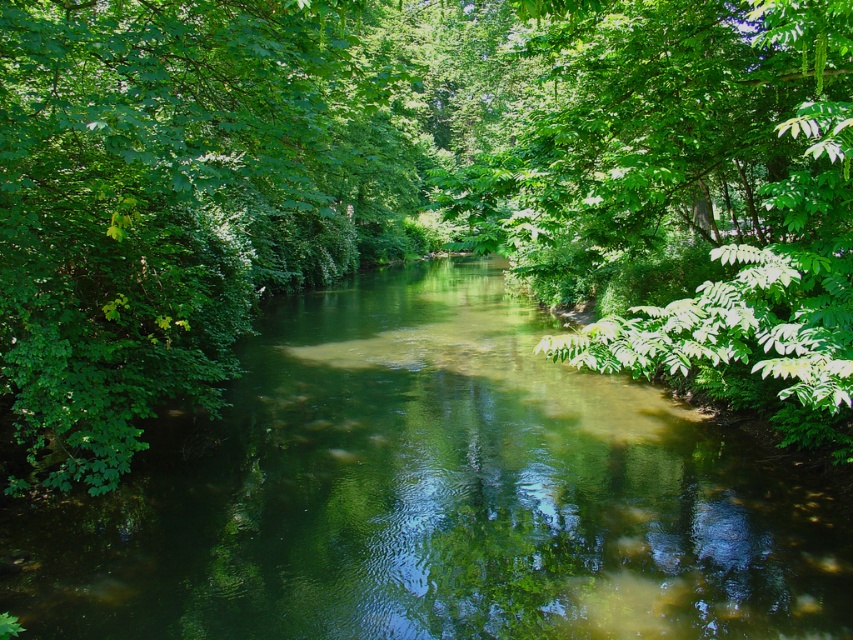
Between green translucent water at center and green leafy tree at left, which one appears on the right side from the viewer's perspective?

green translucent water at center

Is green translucent water at center positioned in front of green leafy tree at left?

No, green translucent water at center is behind green leafy tree at left.

Between point (656, 572) and point (189, 150), which one is positioned behind?

The point (656, 572) is behind.

At what (x,y) coordinates should I click in order to perform the action: click on green translucent water at center. Please return your answer as a coordinate pair (x, y). The width and height of the screenshot is (853, 640). Looking at the image, I should click on (434, 496).